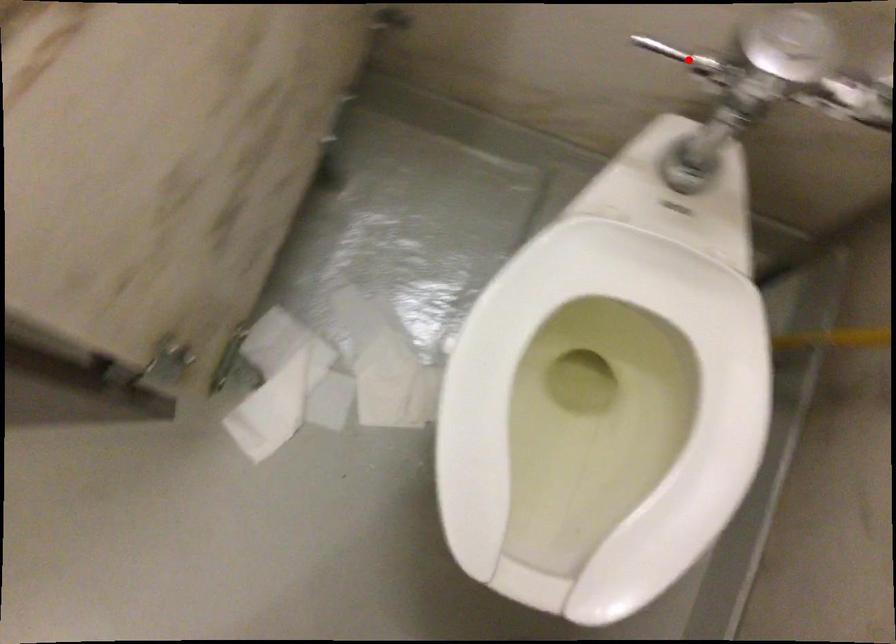
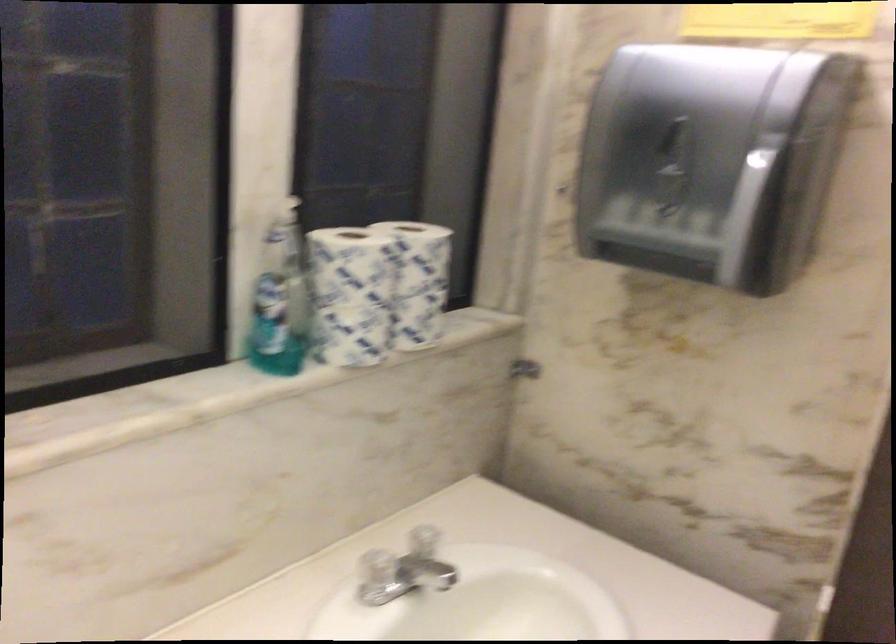
Question: I am providing you with two images of the same scene from different viewpoints. A red point is marked on the first image. At the location where the point appears in image 1, is it still visible in image 2?

Choices:
 (A) Yes
 (B) No

Answer: (B)